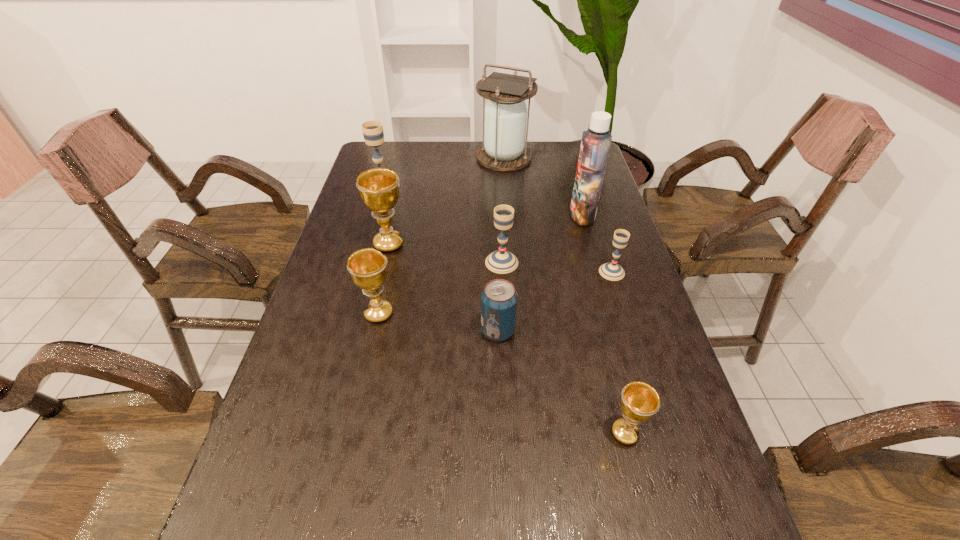
Where is `gold chalice that is the nearest to the second nearest object`? This screenshot has width=960, height=540. gold chalice that is the nearest to the second nearest object is located at coordinates [x=368, y=268].

Find the location of a particular element. gold chalice that can be found as the third closest to the leftmost gray chalice is located at coordinates (639, 402).

Locate which gray chalice ranks second in proximity to the biggest gold chalice. Please provide its 2D coordinates. Your answer should be formatted as a tuple, i.e. [(x, y)], where the tuple contains the x and y coordinates of a point satisfying the conditions above.

[(501, 261)]

What are the coordinates of `gray chalice that is the closest to the teddy bear` in the screenshot? It's located at [x=501, y=261].

I want to click on vacant area that satisfies the following two spatial constraints: 1. on the back side of the rightmost chalice; 2. on the front label of the eighth nearest object, so click(594, 215).

Where is `vacant area that satisfies the following two spatial constraints: 1. on the front label of the blue shampoo; 2. on the left side of the rightmost chalice`? vacant area that satisfies the following two spatial constraints: 1. on the front label of the blue shampoo; 2. on the left side of the rightmost chalice is located at coordinates click(598, 272).

Image resolution: width=960 pixels, height=540 pixels. Find the location of `vacant space that satisfies the following two spatial constraints: 1. on the front side of the leftmost gray chalice; 2. on the left side of the pop soda`. vacant space that satisfies the following two spatial constraints: 1. on the front side of the leftmost gray chalice; 2. on the left side of the pop soda is located at coordinates (340, 331).

The image size is (960, 540). I want to click on free spot that satisfies the following two spatial constraints: 1. on the back side of the rightmost chalice; 2. on the front label of the eighth nearest object, so click(594, 215).

Find the location of a particular element. This screenshot has height=540, width=960. free space that satisfies the following two spatial constraints: 1. on the front side of the second smallest gray chalice; 2. on the right side of the second chalice from right to left is located at coordinates (511, 433).